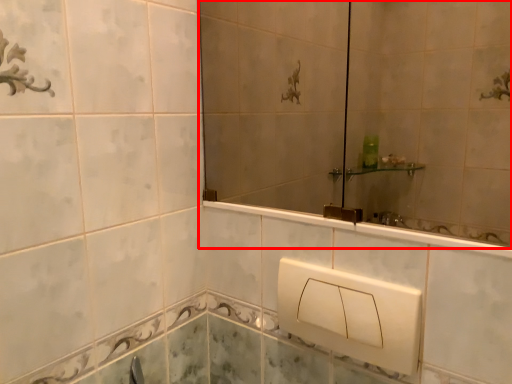
Question: From the image's perspective, where is mirror (annotated by the red box) located in relation to square in the image?

Choices:
 (A) above
 (B) below

Answer: (A)